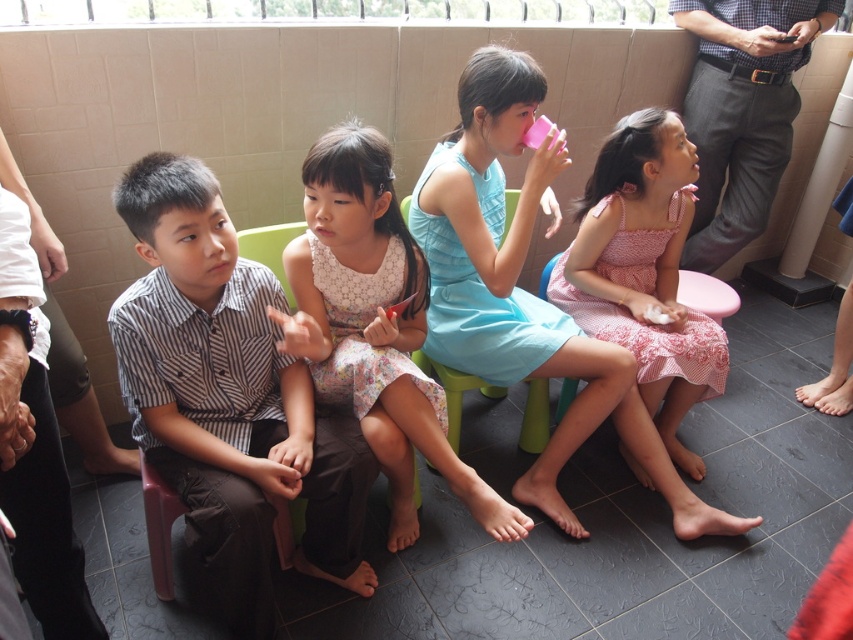
Between striped cotton shirt at center and light blue fabric dress at center, which one has less height?

With less height is striped cotton shirt at center.

Is striped cotton shirt at center bigger than light blue fabric dress at center?

Incorrect, striped cotton shirt at center is not larger than light blue fabric dress at center.

Who is more distant from viewer, [199,477] or [573,358]?

Point [573,358]

Find the location of a particular element. This screenshot has width=853, height=640. striped cotton shirt at center is located at coordinates (228, 397).

Between floral dress at center and pink cotton dress at center, which one appears on the right side from the viewer's perspective?

Positioned to the right is pink cotton dress at center.

Where is `floral dress at center`? This screenshot has height=640, width=853. floral dress at center is located at coordinates (374, 324).

Does striped cotton shirt at center have a larger size compared to floral dress at center?

Incorrect, striped cotton shirt at center is not larger than floral dress at center.

Find the location of a particular element. This screenshot has height=640, width=853. striped cotton shirt at center is located at coordinates (228, 397).